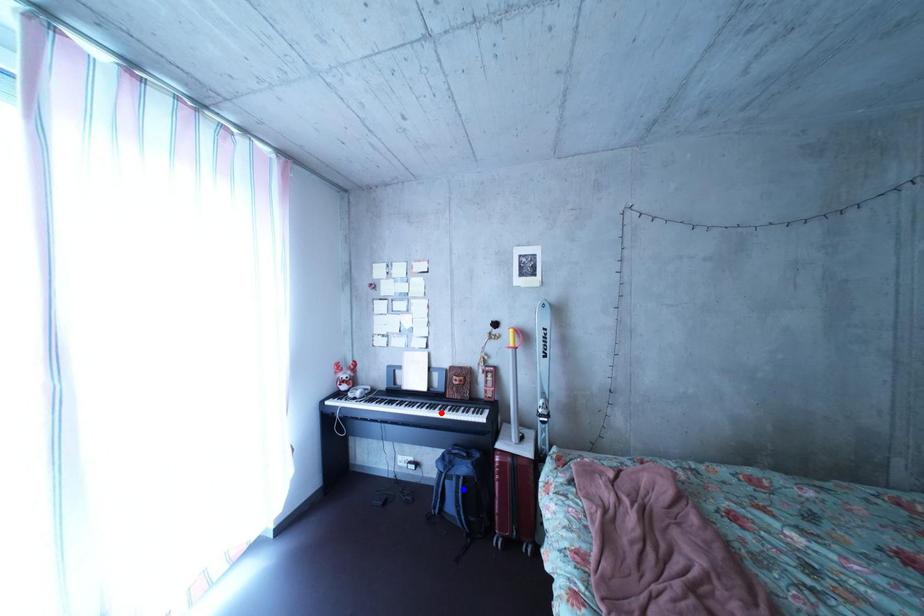
Question: Which of the two points in the image is closer to the camera?

Choices:
 (A) Blue point is closer.
 (B) Red point is closer.

Answer: (A)